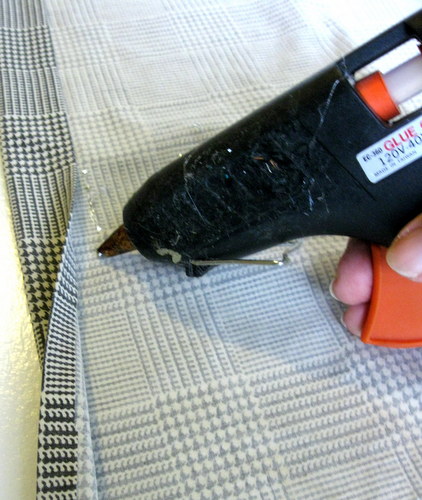
The image size is (422, 500). Identify the location of table. (6, 365).